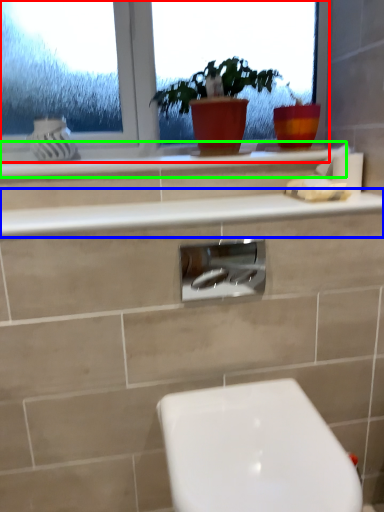
Question: Considering the real-world distances, which object is farthest from window (highlighted by a red box)? counter top (highlighted by a blue box) or counter top (highlighted by a green box)?

Choices:
 (A) counter top
 (B) counter top

Answer: (A)